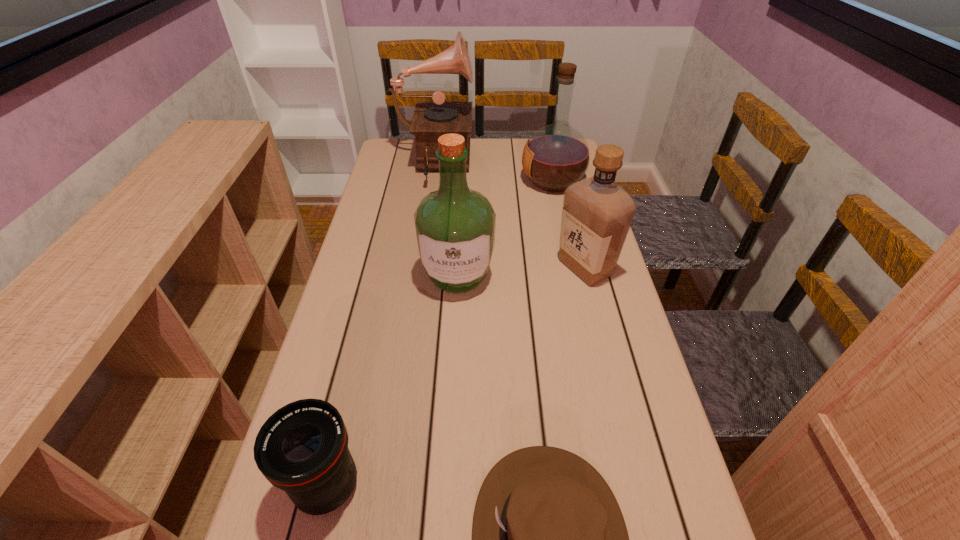
This screenshot has height=540, width=960. Identify the location of record player located in the far edge section of the desktop. (431, 120).

This screenshot has width=960, height=540. I want to click on liquor located in the far edge section of the desktop, so click(557, 155).

Locate an element on the screen. The image size is (960, 540). record player that is at the left edge is located at coordinates 431,120.

Locate an element on the screen. The image size is (960, 540). telephoto lens located in the left edge section of the desktop is located at coordinates (302, 449).

Locate an element on the screen. The image size is (960, 540). object that is at the far left corner is located at coordinates (431, 120).

Find the location of a particular element. object located at the far right corner is located at coordinates (557, 155).

In order to click on free space at the far edge of the desktop in this screenshot , I will do `click(479, 163)`.

In the image, there is a desktop. Where is `vacant space at the left edge`? vacant space at the left edge is located at coordinates (405, 215).

This screenshot has width=960, height=540. In the image, there is a desktop. Identify the location of vacant space at the right edge. (612, 358).

The width and height of the screenshot is (960, 540). What are the coordinates of `vacant space that's between the telephoto lens and the record player` in the screenshot? It's located at (380, 326).